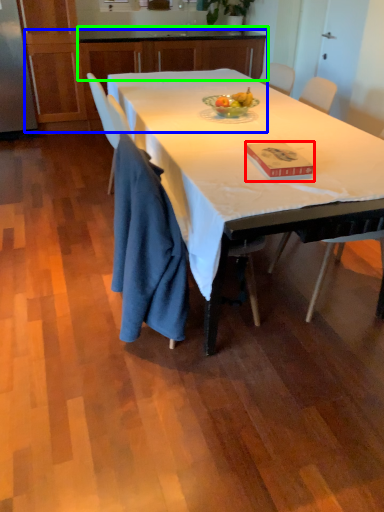
Question: Considering the real-world distances, which object is closest to book (highlighted by a red box)? cabinetry (highlighted by a blue box) or cabinetry (highlighted by a green box).

Choices:
 (A) cabinetry
 (B) cabinetry

Answer: (A)